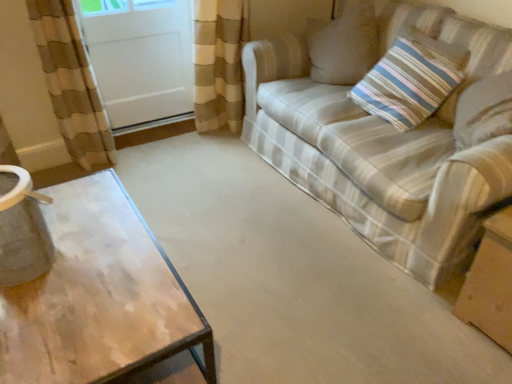
Question: Could white glossy screen door at upper left be considered to be inside striped fabric pillow at upper right?

Choices:
 (A) no
 (B) yes

Answer: (A)

Question: From the image's perspective, is striped fabric pillow at upper right under white glossy screen door at upper left?

Choices:
 (A) no
 (B) yes

Answer: (B)

Question: Is striped fabric pillow at upper right smaller than white glossy screen door at upper left?

Choices:
 (A) yes
 (B) no

Answer: (A)

Question: Can you confirm if striped fabric pillow at upper right is thinner than white glossy screen door at upper left?

Choices:
 (A) yes
 (B) no

Answer: (A)

Question: Is striped fabric pillow at upper right oriented away from white glossy screen door at upper left?

Choices:
 (A) no
 (B) yes

Answer: (A)

Question: From a real-world perspective, is striped fabric pillow at upper right positioned under white glossy screen door at upper left based on gravity?

Choices:
 (A) yes
 (B) no

Answer: (B)

Question: Is white glossy screen door at upper left inside brown cardboard box at lower right?

Choices:
 (A) yes
 (B) no

Answer: (B)

Question: Is brown cardboard box at lower right in contact with white glossy screen door at upper left?

Choices:
 (A) yes
 (B) no

Answer: (B)

Question: Could you tell me if brown cardboard box at lower right is facing white glossy screen door at upper left?

Choices:
 (A) yes
 (B) no

Answer: (B)

Question: Is white glossy screen door at upper left at the back of brown cardboard box at lower right?

Choices:
 (A) no
 (B) yes

Answer: (B)

Question: Does brown cardboard box at lower right have a lesser height compared to white glossy screen door at upper left?

Choices:
 (A) no
 (B) yes

Answer: (B)

Question: Is brown cardboard box at lower right wider than white glossy screen door at upper left?

Choices:
 (A) yes
 (B) no

Answer: (A)

Question: From a real-world perspective, is white glossy screen door at upper left located higher than striped fabric couch at right?

Choices:
 (A) no
 (B) yes

Answer: (A)